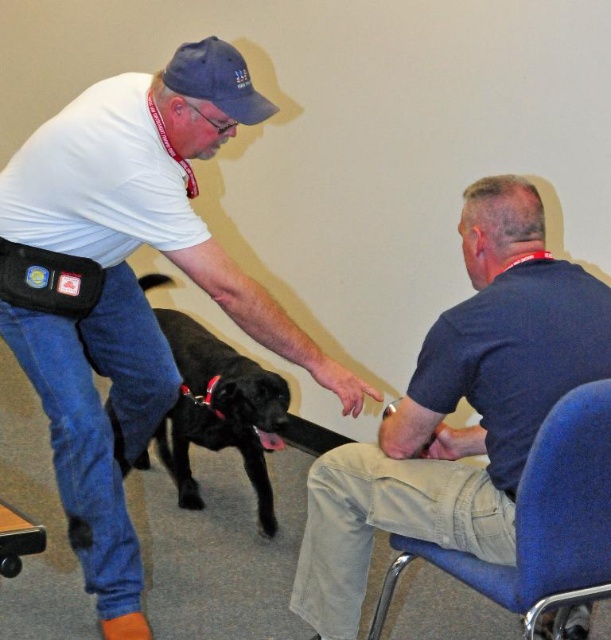
Question: Among these points, which one is farthest from the camera?

Choices:
 (A) (23, 552)
 (B) (381, 612)
 (C) (174, 156)

Answer: (C)

Question: Which object is farther from the camera taking this photo?

Choices:
 (A) dark blue shirt at right
 (B) wooden stool at lower left

Answer: (A)

Question: Is the position of dark blue shirt at right less distant than that of blue fabric chair at lower right?

Choices:
 (A) no
 (B) yes

Answer: (A)

Question: Can you confirm if dark blue shirt at right is positioned to the left of blue fabric chair at lower right?

Choices:
 (A) no
 (B) yes

Answer: (B)

Question: Can you confirm if dark blue shirt at right is positioned below blue fabric chair at lower right?

Choices:
 (A) no
 (B) yes

Answer: (A)

Question: Which point is farther to the camera?

Choices:
 (A) (73, 300)
 (B) (10, 554)
 (C) (507, 177)
 (D) (497, 580)

Answer: (A)